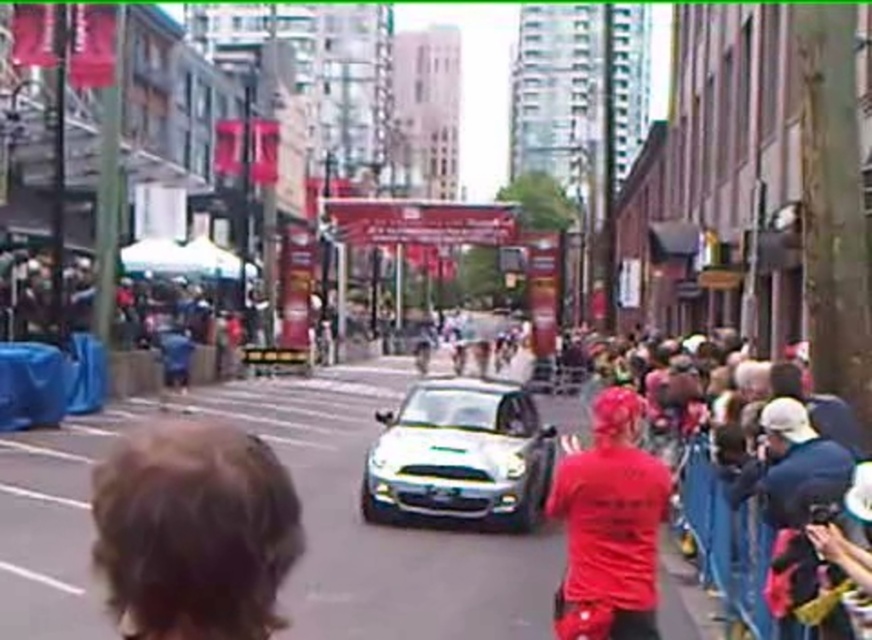
You are a photographer positioned at the edge of the street. You need to capture a photo of the red matte shirt at center without the white metallic sports car at center blocking it. Since the car is wider, how should you adjust your camera angle to ensure the shirt is fully visible?

Since the white metallic sports car at center is wider than the red matte shirt at center, you should aim your camera to the side of the car to avoid obstruction, ensuring the red matte shirt at center remains in view.

You are standing on the street and want to reach a point that is exactly 2 meters away from you. Is the point at coordinates point [263,472] within this distance?

The point [263,472] is 1.97 meters from viewer, so yes, it is within the 2 meters distance.